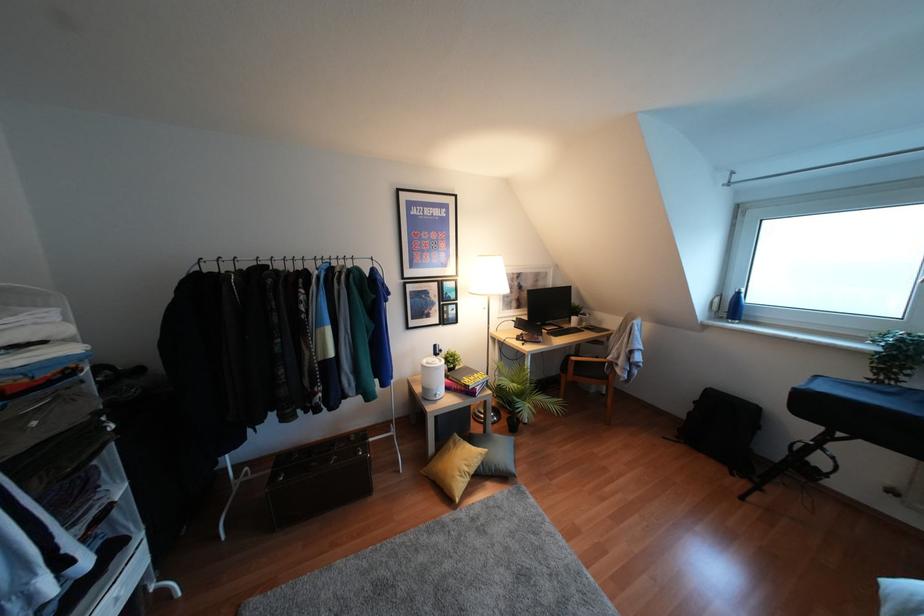
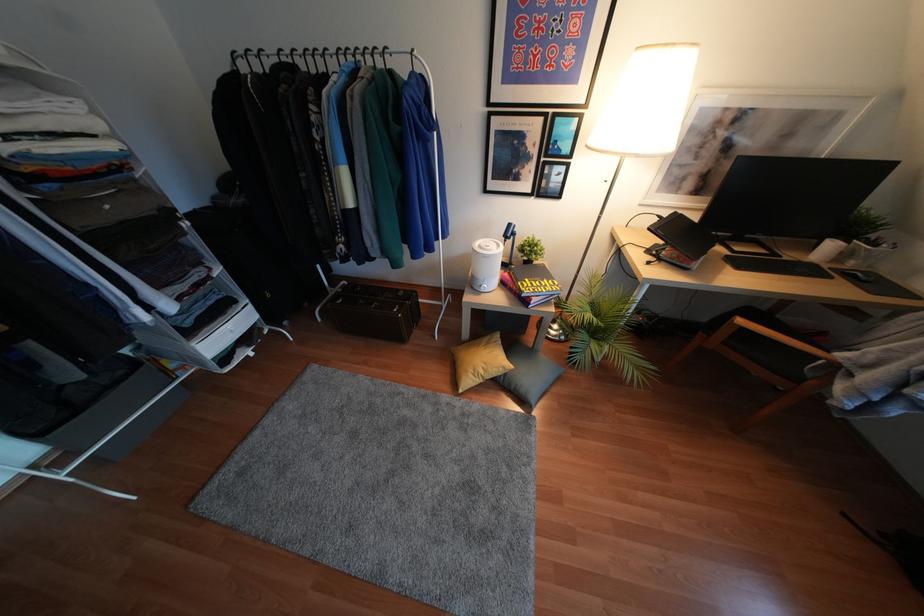
Question: I am providing you with two images of the same scene from different viewpoints. Please identify which objects are invisible in image2.

Choices:
 (A) white pen holder
 (B) red photography book
 (C) small potted plant
 (D) none of these

Answer: (D)